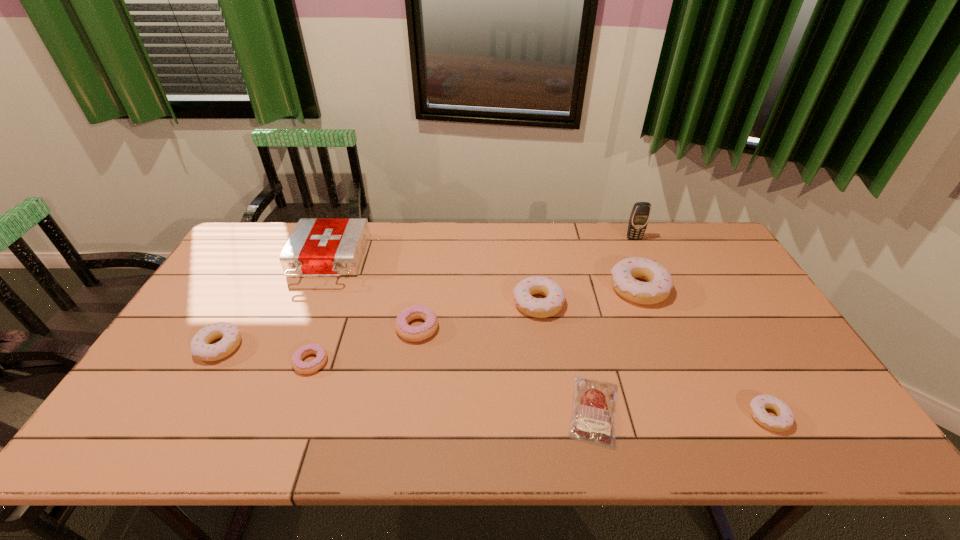
Locate an element on the screen. This screenshot has width=960, height=540. the smaller pink doughnut is located at coordinates (298, 365).

Find the location of a particular element. the nearer pink doughnut is located at coordinates (298, 365).

I want to click on the smallest white doughnut, so point(785,417).

This screenshot has width=960, height=540. In order to click on the rightmost object in this screenshot , I will do (x=785, y=417).

Where is `the shortest object`? The width and height of the screenshot is (960, 540). the shortest object is located at coordinates tap(592, 421).

The width and height of the screenshot is (960, 540). Identify the location of free space located on the front face of the cellular telephone. (657, 289).

The width and height of the screenshot is (960, 540). I want to click on free space located 0.200m on the front side of the red first-aid kit, so 296,339.

In order to click on vacant space situated on the back of the biggest white doughnut in this screenshot , I will do `click(614, 227)`.

At what (x,y) coordinates should I click in order to perform the action: click on free space located 0.090m on the front of the third white doughnut from right to left. Please return your answer as a coordinate pair (x, y). The width and height of the screenshot is (960, 540). Looking at the image, I should click on (544, 346).

At what (x,y) coordinates should I click in order to perform the action: click on free space located on the right of the sixth object from right to left. Please return your answer as a coordinate pair (x, y). Image resolution: width=960 pixels, height=540 pixels. Looking at the image, I should click on (549, 328).